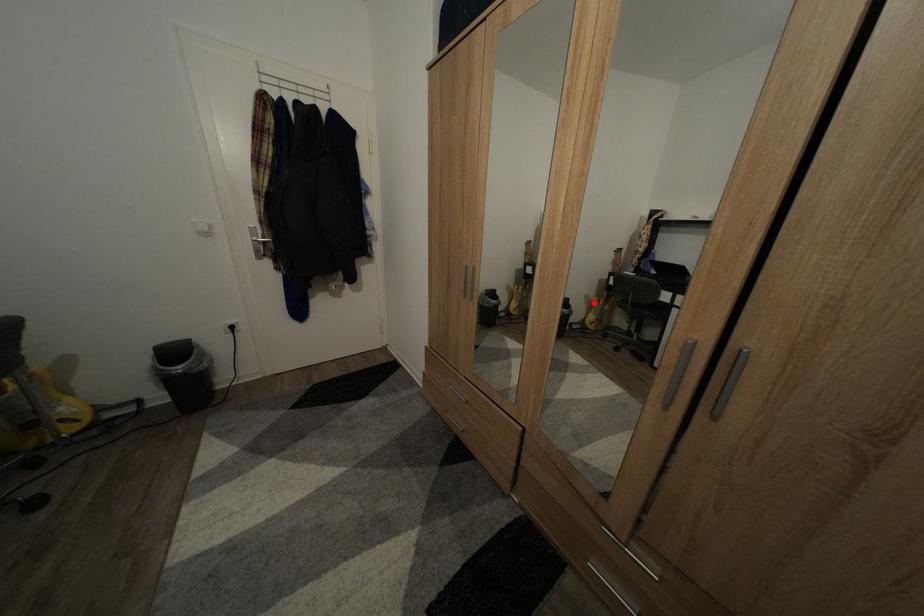
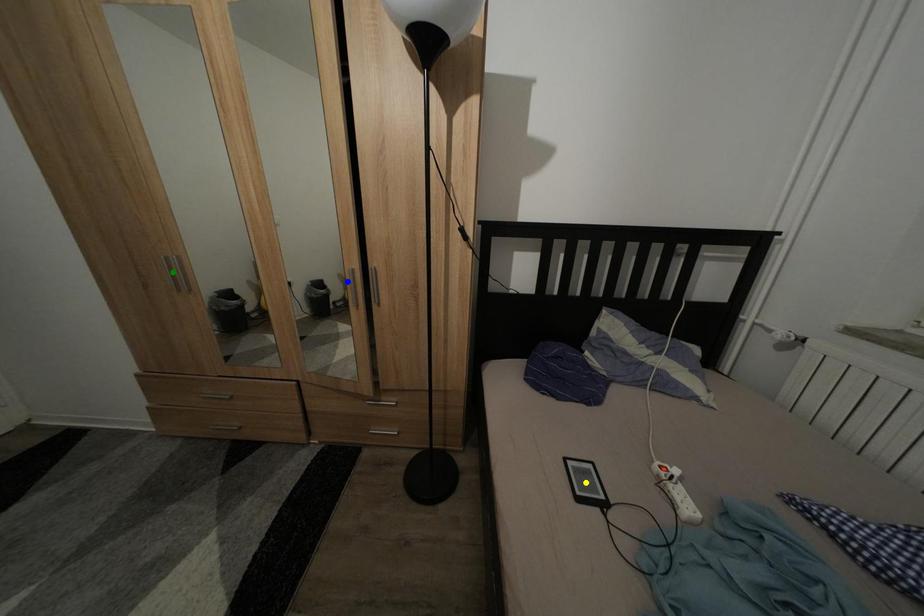
Question: I am providing you with two images of the same scene from different viewpoints. A red point is marked on the first image. You are given multiple points on the second image. Which point in image 2 is actually the same real-world point as the red point in image 1?

Choices:
 (A) green point
 (B) yellow point
 (C) blue point

Answer: (C)